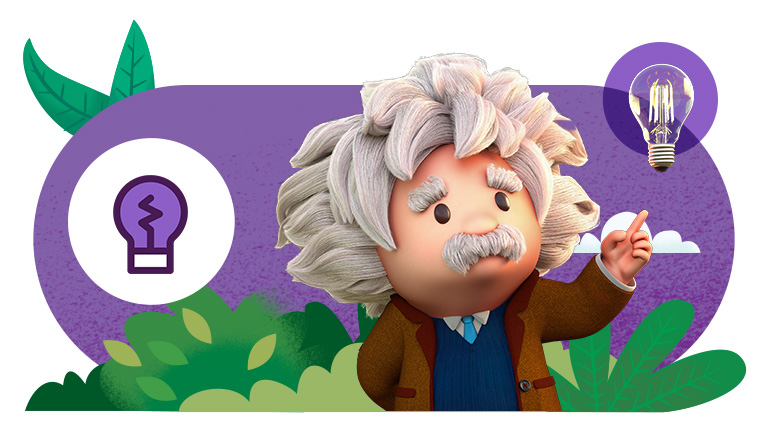
Image resolution: width=768 pixels, height=432 pixels. In order to click on glass lightbulb in this screenshot , I will do [664, 94].